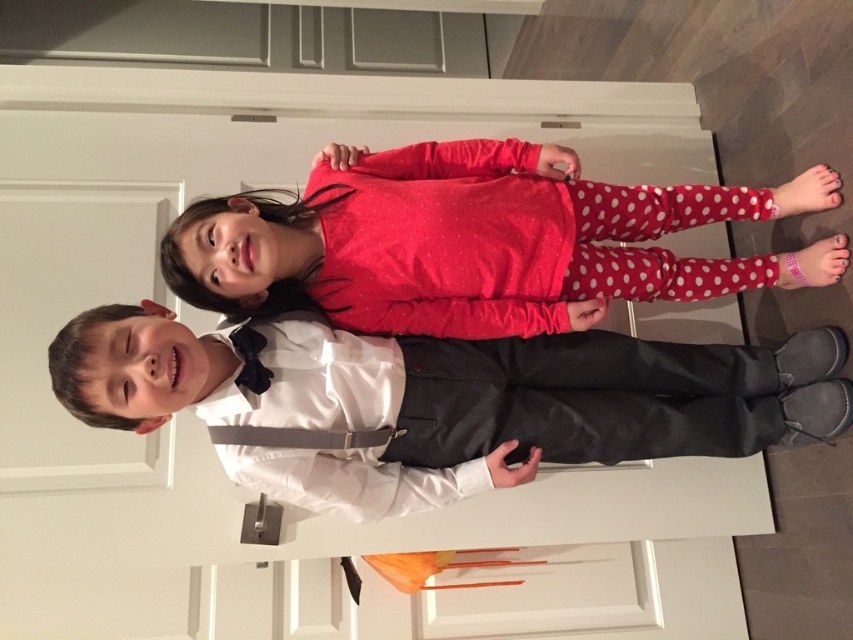
You are a photographer setting up for a group photo. You need to position the two children so that their shirts are visible. Given that the white satin shirt at center and the matte red shirt at center are part of their outfits, which shirt is positioned to the left of the other?

The white satin shirt at center is to the left of the matte red shirt at center according to the description.

You are taking a photo of the two children in the hallway. You want to focus on the point that is closer to the camera. Which point should you choose between point (604, 330) and point (477, 317)?

Point (477, 317) is closer to the camera than point (604, 330), so you should focus on point (477, 317).

What is the exact coordinate of the white satin shirt at center?

The white satin shirt at center is located at coordinate point [439,400].